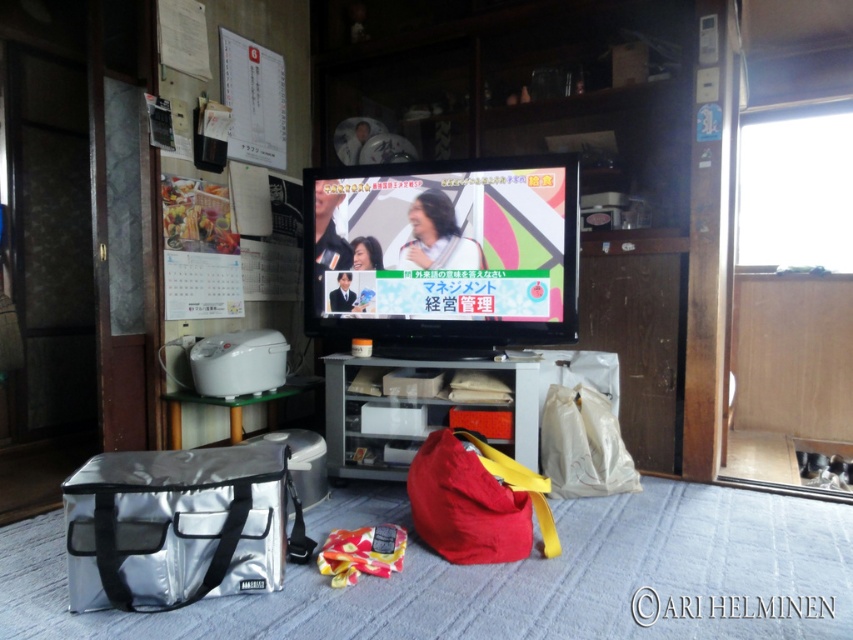
Is silver/reflective insulated bag at lower left below matte red bag at center?

No.

Between point (274, 568) and point (490, 461), which one is positioned behind?

Positioned behind is point (490, 461).

Find the location of `silver/reflective insulated bag at lower left`. silver/reflective insulated bag at lower left is located at coordinates (178, 525).

Is matte plastic tv at center behind silver/reflective insulated bag at lower left?

Yes, it is behind silver/reflective insulated bag at lower left.

Which is in front, point (457, 211) or point (207, 468)?

Point (207, 468)

The height and width of the screenshot is (640, 853). Identify the location of matte plastic tv at center. (444, 250).

Is matte plastic tv at center wider than matte red bag at center?

Yes.

Is matte plastic tv at center thinner than matte red bag at center?

No.

Identify the location of matte plastic tv at center. Image resolution: width=853 pixels, height=640 pixels. (444, 250).

You are a GUI agent. You are given a task and a screenshot of the screen. Output one action in this format:
    pyautogui.click(x=<x>, y=<y>)
    Task: Click on the matte plastic tv at center
    
    Given the screenshot: What is the action you would take?
    pyautogui.click(x=444, y=250)